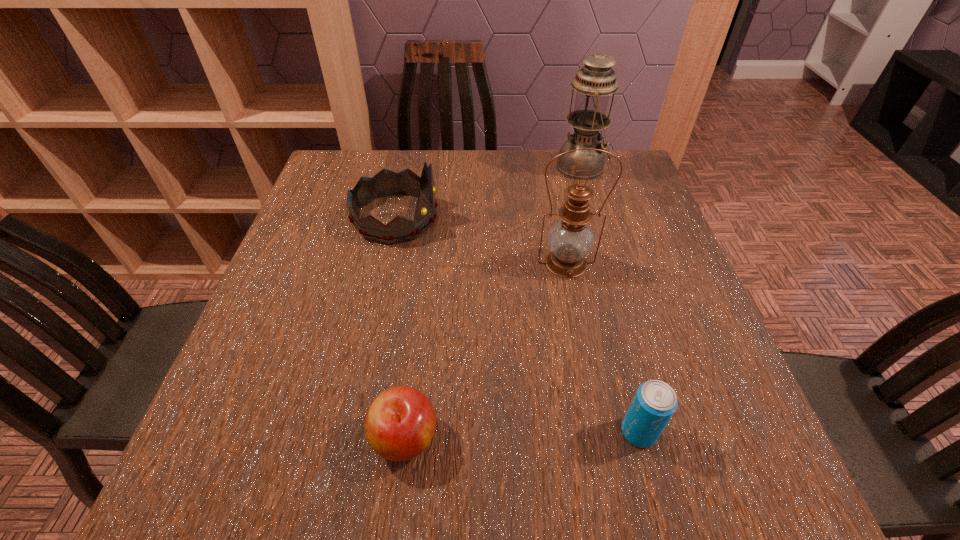
This screenshot has width=960, height=540. Identify the location of the farthest object. (594, 82).

Where is `the third nearest object`? the third nearest object is located at coordinates (571, 239).

Find the location of a particular element. The height and width of the screenshot is (540, 960). the second farthest object is located at coordinates click(x=385, y=183).

Where is `the third shortest object`? the third shortest object is located at coordinates (385, 183).

Locate an element on the screen. This screenshot has height=540, width=960. the fourth tallest object is located at coordinates (655, 402).

Identify the location of the shortest object. (400, 423).

Where is `blank space located on the left of the farthest object`? blank space located on the left of the farthest object is located at coordinates (448, 167).

The height and width of the screenshot is (540, 960). I want to click on free space located on the front of the third nearest object, so click(587, 367).

Locate an element on the screen. The height and width of the screenshot is (540, 960). vacant area located 0.290m at the front of the second farthest object with jewels is located at coordinates (555, 218).

You are a GUI agent. You are given a task and a screenshot of the screen. Output one action in this format:
    pyautogui.click(x=<x>, y=<y>)
    Task: Click on the free space located on the right of the soda can
    The width and height of the screenshot is (960, 540).
    Given the screenshot: What is the action you would take?
    pyautogui.click(x=755, y=431)